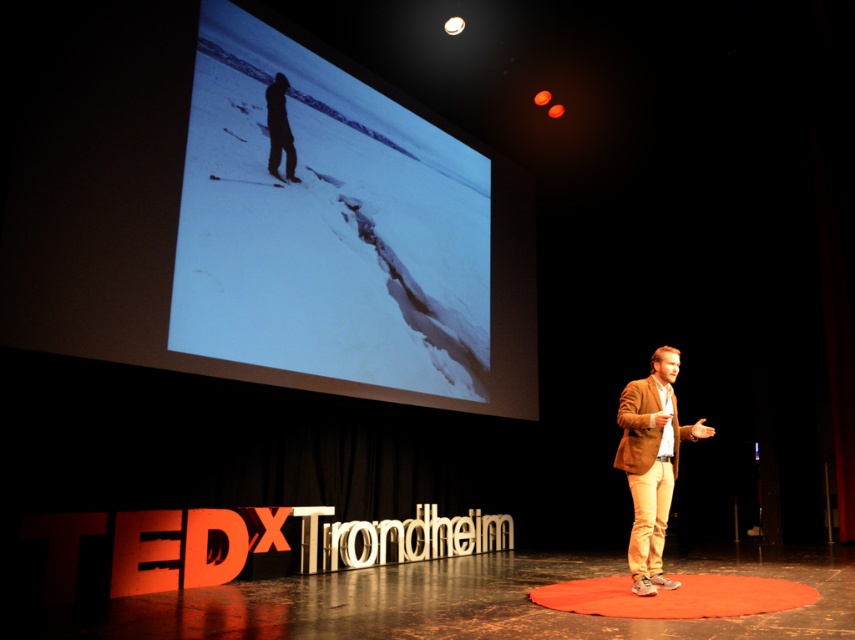
Question: Which of these objects is positioned closest to the rubberized orange circle at center?

Choices:
 (A) dark silhouette figure at upper center
 (B) silvery metallic screen at upper center
 (C) brown leather jacket at center

Answer: (C)

Question: Does silvery metallic screen at upper center have a greater width compared to brown leather jacket at center?

Choices:
 (A) yes
 (B) no

Answer: (A)

Question: Is rubberized orange circle at center bigger than dark silhouette figure at upper center?

Choices:
 (A) yes
 (B) no

Answer: (A)

Question: Which of these objects is positioned farthest from the silvery metallic screen at upper center?

Choices:
 (A) rubberized orange circle at center
 (B) brown leather jacket at center
 (C) dark silhouette figure at upper center

Answer: (A)

Question: Which is farther from the rubberized orange circle at center?

Choices:
 (A) brown leather jacket at center
 (B) silvery metallic screen at upper center
 (C) dark silhouette figure at upper center

Answer: (C)

Question: Is the position of silvery metallic screen at upper center less distant than that of brown leather jacket at center?

Choices:
 (A) no
 (B) yes

Answer: (A)